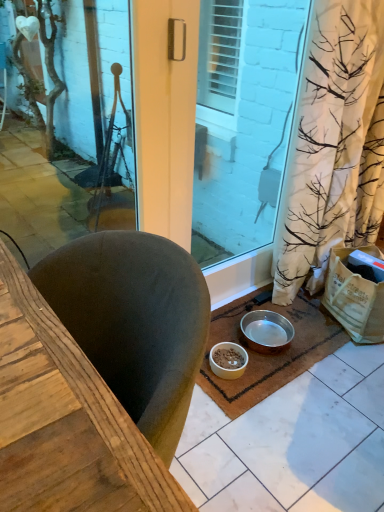
Locate an element on the screen. The width and height of the screenshot is (384, 512). vacant area to the right of metallic silver bowl at lower center, placed as the first bowl when sorted from right to left is located at coordinates (310, 337).